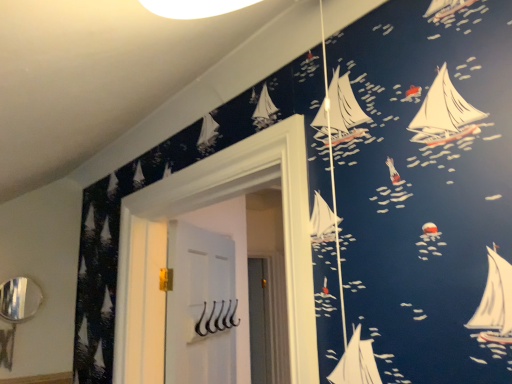
What is the approximate width of white matte hooks at center?

3.24 inches.

What do you see at coordinates (200, 306) in the screenshot?
I see `white matte hooks at center` at bounding box center [200, 306].

This screenshot has width=512, height=384. Find the location of `white matte hooks at center`. white matte hooks at center is located at coordinates (200, 306).

In order to face silver metallic mirror at lower left, should I rotate leftwards or rightwards?

You should look left and rotate roughly 28.846 degrees.

What do you see at coordinates (19, 299) in the screenshot? I see `silver metallic mirror at lower left` at bounding box center [19, 299].

At what (x,y) coordinates should I click in order to perform the action: click on silver metallic mirror at lower left. Please return your answer as a coordinate pair (x, y). This screenshot has width=512, height=384. Looking at the image, I should click on (19, 299).

Identify the location of white matte hooks at center. (200, 306).

Can you confirm if white matte hooks at center is positioned to the left of silver metallic mirror at lower left?

Incorrect, white matte hooks at center is not on the left side of silver metallic mirror at lower left.

Which is behind, white matte hooks at center or silver metallic mirror at lower left?

Positioned behind is silver metallic mirror at lower left.

Between point (208, 238) and point (34, 312), which one is positioned behind?

The point (208, 238) is more distant.

From the image's perspective, which one is positioned lower, white matte hooks at center or silver metallic mirror at lower left?

white matte hooks at center, from the image's perspective.

From a real-world perspective, which is physically below, white matte hooks at center or silver metallic mirror at lower left?

white matte hooks at center is physically lower.

Which object is wider, white matte hooks at center or silver metallic mirror at lower left?

white matte hooks at center is wider.

Considering the sizes of objects white matte hooks at center and silver metallic mirror at lower left in the image provided, who is shorter, white matte hooks at center or silver metallic mirror at lower left?

silver metallic mirror at lower left is shorter.

Considering the sizes of objects white matte hooks at center and silver metallic mirror at lower left in the image provided, who is bigger, white matte hooks at center or silver metallic mirror at lower left?

With larger size is white matte hooks at center.

Is white matte hooks at center not within silver metallic mirror at lower left?

Indeed, white matte hooks at center is completely outside silver metallic mirror at lower left.

Are white matte hooks at center and silver metallic mirror at lower left making contact?

white matte hooks at center is not next to silver metallic mirror at lower left, and they're not touching.

Is white matte hooks at center turned away from silver metallic mirror at lower left?

Yes, white matte hooks at center is facing away from silver metallic mirror at lower left.

Where is `mirror lying on the left of white matte hooks at center`? The height and width of the screenshot is (384, 512). mirror lying on the left of white matte hooks at center is located at coordinates (19, 299).

Looking at this image, is silver metallic mirror at lower left to the left of white matte hooks at center from the viewer's perspective?

Yes, silver metallic mirror at lower left is to the left of white matte hooks at center.

Considering the relative positions of silver metallic mirror at lower left and white matte hooks at center in the image provided, is silver metallic mirror at lower left behind white matte hooks at center?

Yes, it is.

In the scene shown: Which is closer to the camera, (28, 285) or (182, 274)?

Point (28, 285) is positioned farther from the camera compared to point (182, 274).

From the image's perspective, is silver metallic mirror at lower left on white matte hooks at center?

Yes, from the image's perspective, silver metallic mirror at lower left is over white matte hooks at center.

From a real-world perspective, is silver metallic mirror at lower left located higher than white matte hooks at center?

Correct, in the physical world, silver metallic mirror at lower left is higher than white matte hooks at center.

Considering the sizes of objects silver metallic mirror at lower left and white matte hooks at center in the image provided, who is thinner, silver metallic mirror at lower left or white matte hooks at center?

Thinner between the two is silver metallic mirror at lower left.

Can you confirm if silver metallic mirror at lower left is taller than white matte hooks at center?

No, silver metallic mirror at lower left is not taller than white matte hooks at center.

Is silver metallic mirror at lower left smaller than white matte hooks at center?

Indeed, silver metallic mirror at lower left has a smaller size compared to white matte hooks at center.

Consider the image. Is white matte hooks at center a part of silver metallic mirror at lower left?

No, white matte hooks at center is located outside of silver metallic mirror at lower left.

Is silver metallic mirror at lower left directly adjacent to white matte hooks at center?

No.

Looking at this image, is white matte hooks at center at the back of silver metallic mirror at lower left?

silver metallic mirror at lower left is not turned away from white matte hooks at center.

How far apart are silver metallic mirror at lower left and white matte hooks at center?

silver metallic mirror at lower left and white matte hooks at center are 70.71 centimeters apart from each other.

Identify the location of mirror that appears on the left of white matte hooks at center. (19, 299).

Locate an element on the screen. The width and height of the screenshot is (512, 384). door below the silver metallic mirror at lower left (from a real-world perspective) is located at coordinates (200, 306).

Locate an element on the screen. Image resolution: width=512 pixels, height=384 pixels. mirror on the left of white matte hooks at center is located at coordinates (19, 299).